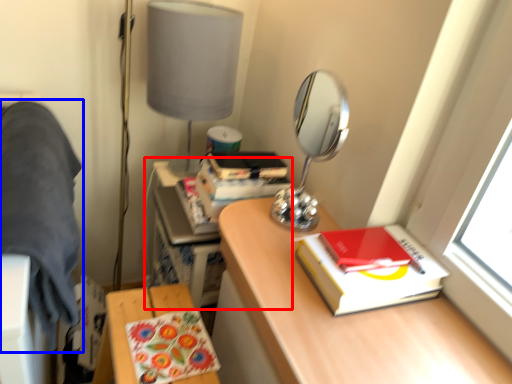
Question: Among these objects, which one is farthest to the camera, computer desk (highlighted by a red box) or bedding (highlighted by a blue box)?

Choices:
 (A) computer desk
 (B) bedding

Answer: (A)